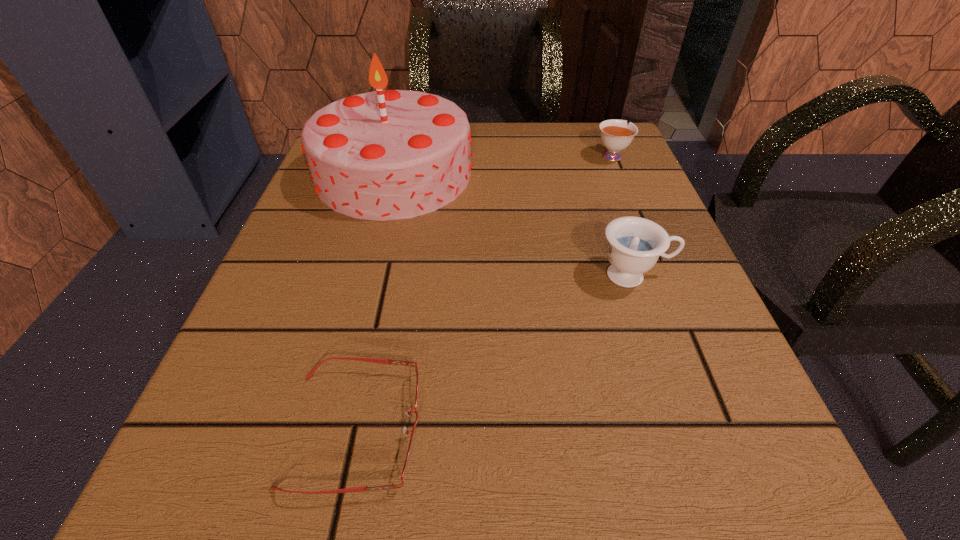
At what (x,y) coordinates should I click in order to perform the action: click on birthday cake. Please return your answer as a coordinate pair (x, y). This screenshot has width=960, height=540. Looking at the image, I should click on (386, 155).

Locate an element on the screen. The width and height of the screenshot is (960, 540). the third farthest object is located at coordinates pos(634,245).

Locate an element on the screen. the nearer teacup is located at coordinates (634, 245).

At what (x,y) coordinates should I click in order to perform the action: click on the second shortest object. Please return your answer as a coordinate pair (x, y). The width and height of the screenshot is (960, 540). Looking at the image, I should click on (615, 134).

The height and width of the screenshot is (540, 960). Identify the location of the farther teacup. (615, 134).

At what (x,y) coordinates should I click in order to perform the action: click on the shortest object. Please return your answer as a coordinate pair (x, y). The height and width of the screenshot is (540, 960). Looking at the image, I should click on (373, 360).

Where is `the nearest object`? the nearest object is located at coordinates (373, 360).

Locate an element on the screen. This screenshot has width=960, height=540. blank space located on the right of the tallest object is located at coordinates (627, 173).

Find the location of a particular element. free region located on the side of the farther teacup with the handle is located at coordinates (599, 126).

The height and width of the screenshot is (540, 960). Find the location of `blank space located 0.300m on the lenses of the spectacles`. blank space located 0.300m on the lenses of the spectacles is located at coordinates click(690, 429).